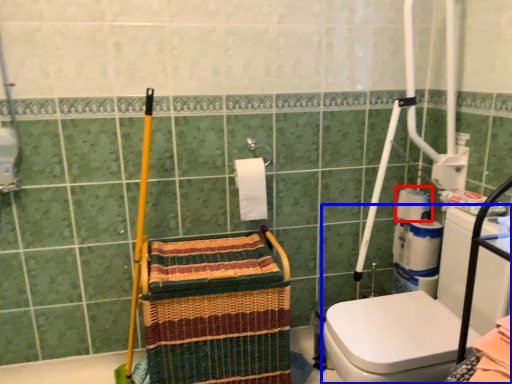
Question: Among these objects, which one is nearest to the camera, toilet paper (highlighted by a red box) or washer (highlighted by a blue box)?

Choices:
 (A) toilet paper
 (B) washer

Answer: (B)